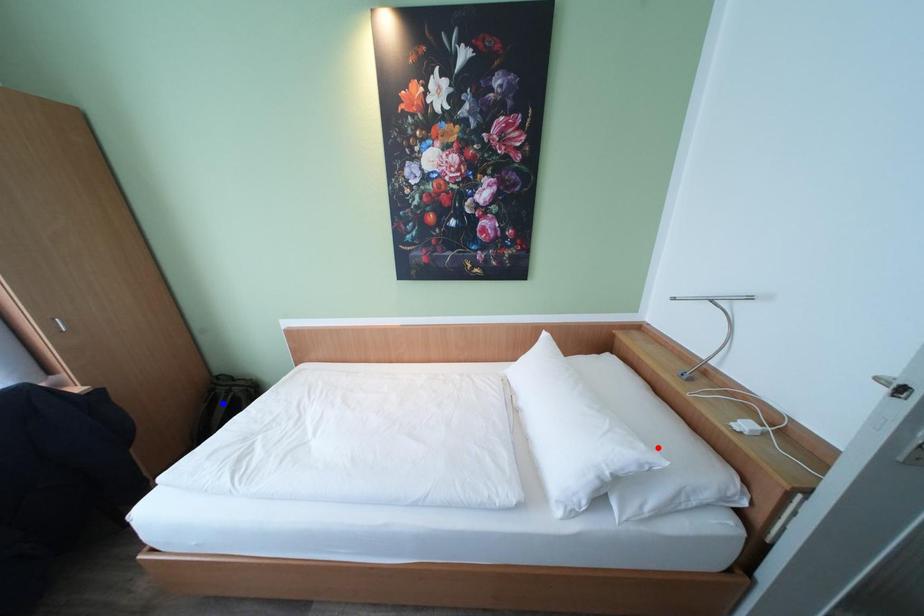
Question: Two points are marked on the image. Which point is closer to the camera?

Choices:
 (A) Blue point is closer.
 (B) Red point is closer.

Answer: (B)